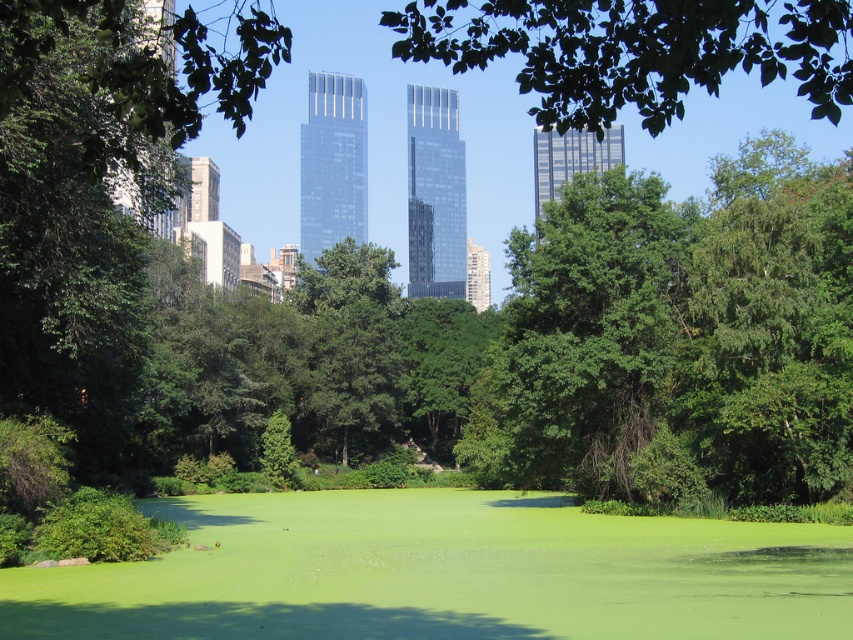
Who is positioned more to the right, green leafy tree at center or green leafy tree at upper center?

green leafy tree at upper center is more to the right.

Is point (569, 307) in front of point (689, 61)?

No, (569, 307) is behind (689, 61).

Which is in front, point (495, 392) or point (770, 58)?

Point (770, 58)

I want to click on green leafy tree at center, so click(584, 339).